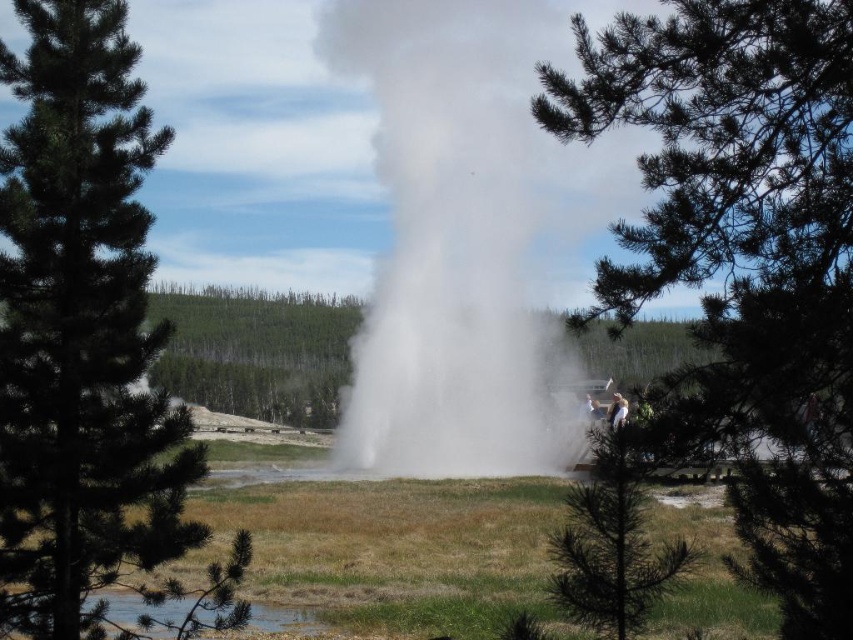
Question: Can you confirm if dark green pine at lower right is smaller than white cotton shirt at center?

Choices:
 (A) no
 (B) yes

Answer: (A)

Question: Which object is farther from the camera taking this photo?

Choices:
 (A) clear water at lower left
 (B) green needle-like tree at left
 (C) white vapor at center
 (D) green leafy tree at center

Answer: (C)

Question: Which point is closer to the camera taking this photo?

Choices:
 (A) (115, 140)
 (B) (695, 557)
 (C) (619, 396)

Answer: (B)

Question: Which point is farther to the camera?

Choices:
 (A) (419, 224)
 (B) (277, 618)
 (C) (614, 410)
 (D) (241, 532)

Answer: (A)

Question: Can you confirm if clear water at lower left is positioned to the right of white cotton shirt at center?

Choices:
 (A) no
 (B) yes

Answer: (A)

Question: Does green leafy tree at center appear over dark green pine at lower right?

Choices:
 (A) no
 (B) yes

Answer: (B)